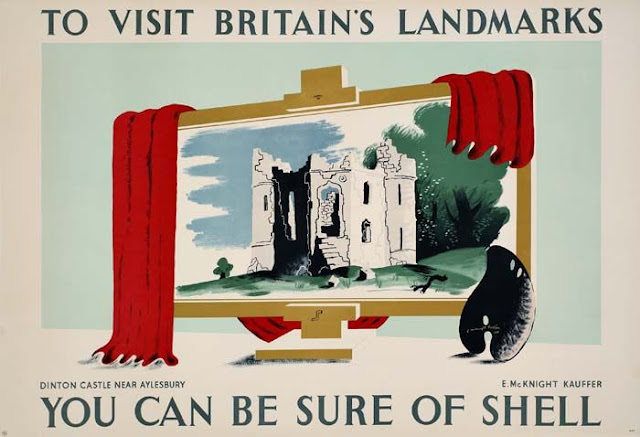
This screenshot has width=640, height=437. I want to click on stairs, so click(326, 256).